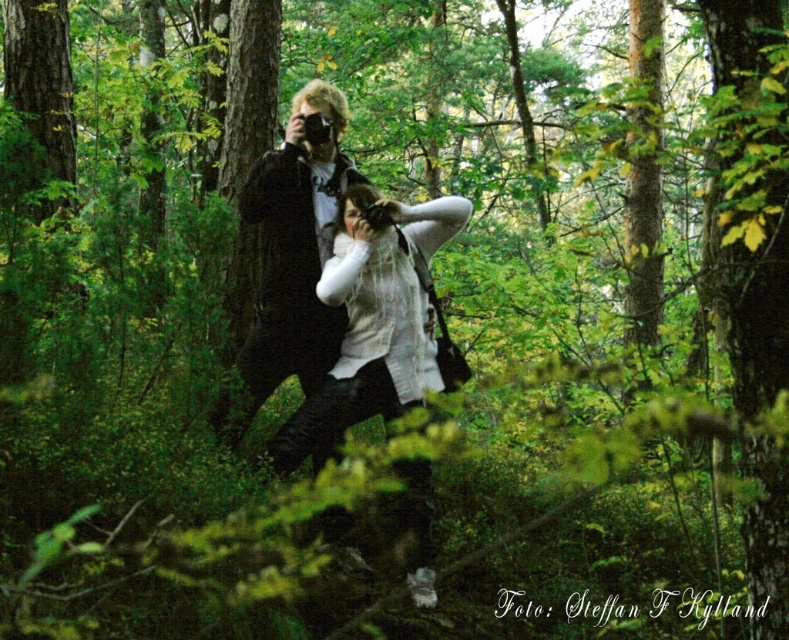
Question: Can you confirm if white knitted sweater at center is positioned to the left of matte black jacket at center?

Choices:
 (A) no
 (B) yes

Answer: (A)

Question: Which point appears closest to the camera in this image?

Choices:
 (A) (308, 177)
 (B) (350, 380)

Answer: (B)

Question: Which of the following is the closest to the observer?

Choices:
 (A) white knitted sweater at center
 (B) matte black jacket at center

Answer: (A)

Question: Does white knitted sweater at center have a greater width compared to matte black jacket at center?

Choices:
 (A) no
 (B) yes

Answer: (B)

Question: Does white knitted sweater at center appear on the right side of matte black jacket at center?

Choices:
 (A) yes
 (B) no

Answer: (A)